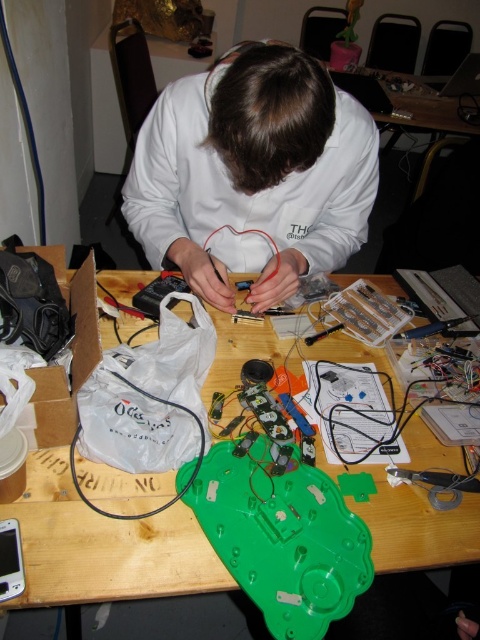
Question: Which of the following is the farthest from the observer?

Choices:
 (A) white matte shirt at center
 (B) green plastic table at center

Answer: (A)

Question: Where is white matte shirt at center located in relation to green plastic table at center in the image?

Choices:
 (A) left
 (B) right

Answer: (B)

Question: Which point is closer to the camera taking this photo?

Choices:
 (A) (155, 173)
 (B) (224, 353)

Answer: (B)

Question: Is white matte shirt at center smaller than green plastic table at center?

Choices:
 (A) yes
 (B) no

Answer: (A)

Question: Is white matte shirt at center wider than green plastic table at center?

Choices:
 (A) yes
 (B) no

Answer: (B)